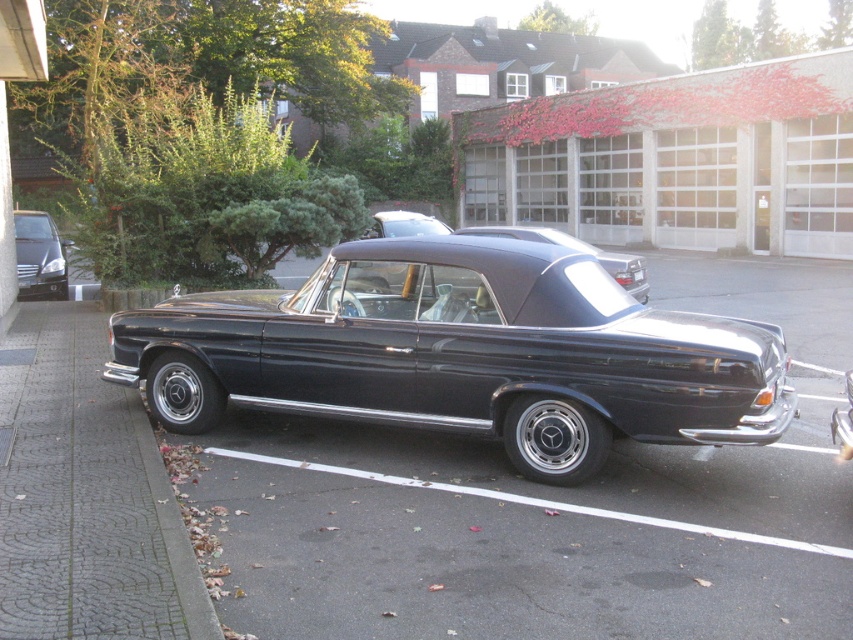
You are a delivery person trying to park your van between the matte black car at left and the glossy black convertible at center. The van is 4 meters long. Can you fit it in the space between them?

The matte black car at left is shorter than the glossy black convertible at center, but the exact distance between them isn not provided. Without knowing the space between the two cars, it is impossible to determine if the van will fit.

You are a delivery person trying to park your van between the shiny black convertible at center and the matte black car at left. Can you safely park your van there if the space between them is only 2 meters wide?

The shiny black convertible at center is closer to the viewer than the matte black car at left. This means the distance between them might not be sufficient for a van to park safely, especially if the space is only 2 meters wide. However, since the exact depth isn